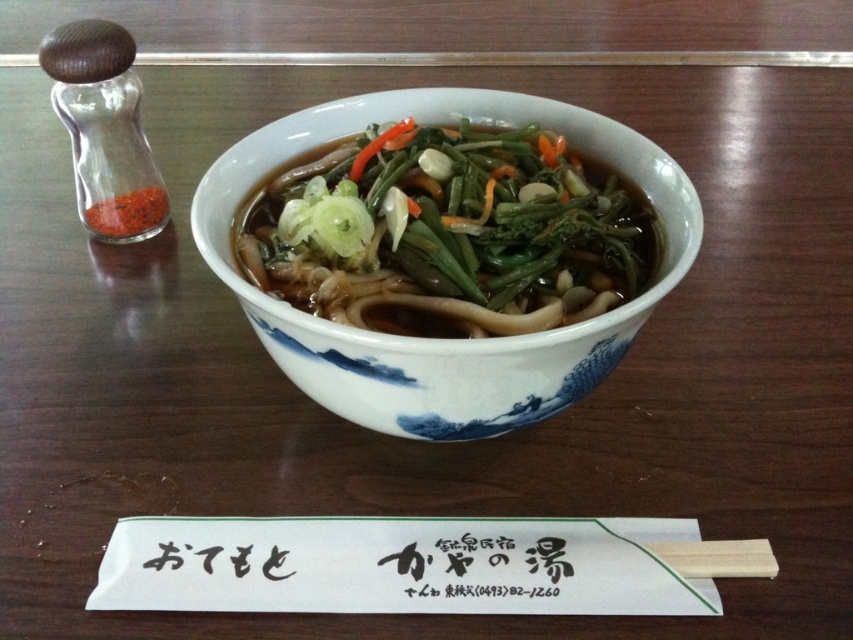
You are setting up a table for a Japanese meal. You have a white glossy bowl at center and a transparent glass container at left. Which item is shorter?

The white glossy bowl at center is shorter than the transparent glass container at left.